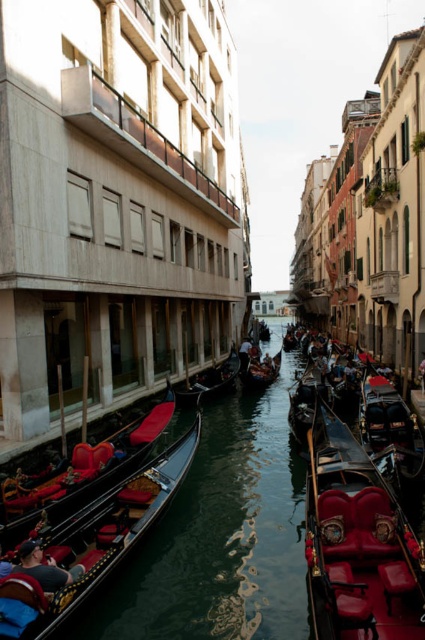
You are a tourist in Venice and want to take a gondola ride. You notice two gondolas in the canal. The shiny black gondola at right and the wooden gondola at center. Which one is narrower?

The shiny black gondola at right is thinner than wooden gondola at center, so the shiny black gondola at right is narrower.

You are standing at the point with coordinates point (399, 408) and want to reach the point with coordinates point (329, 580). Based on the scene description, which direction should you move to get there?

You should move forward because point (329, 580) is in front of point (399, 408) according to the scene description.